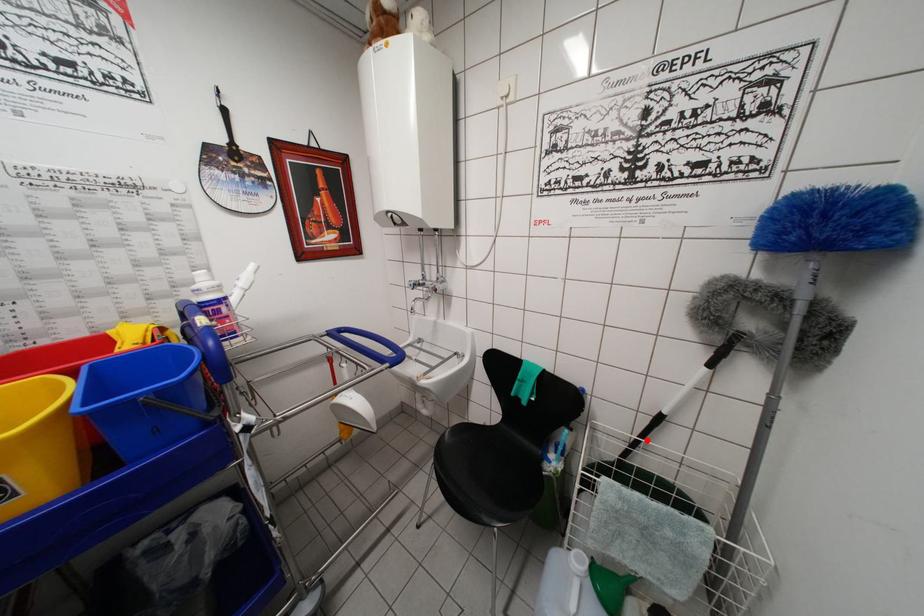
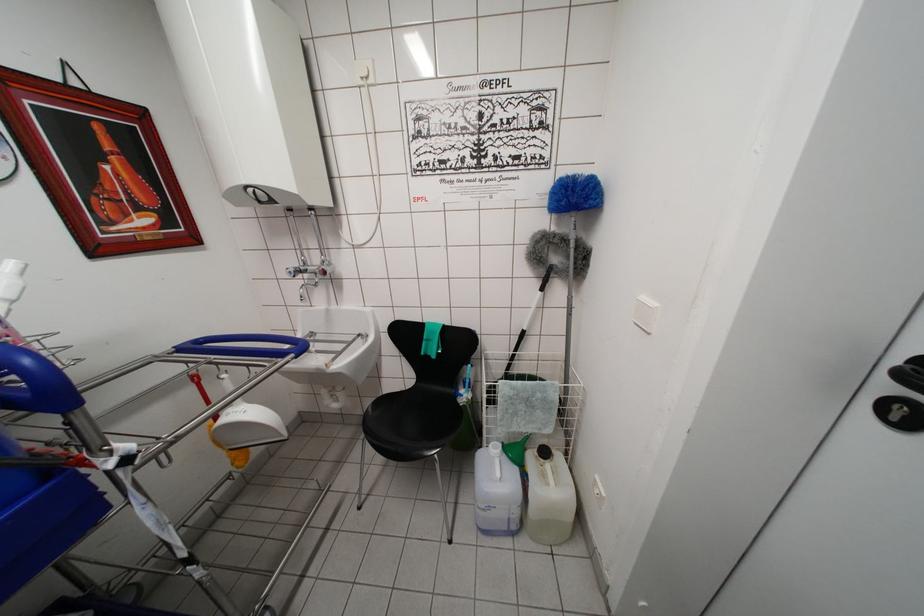
Question: I am providing you with two images of the same scene from different viewpoints. A red point is shown in image1. For the corresponding object point in image2, is it positioned nearer or farther from the camera?

Choices:
 (A) Nearer
 (B) Farther

Answer: (B)